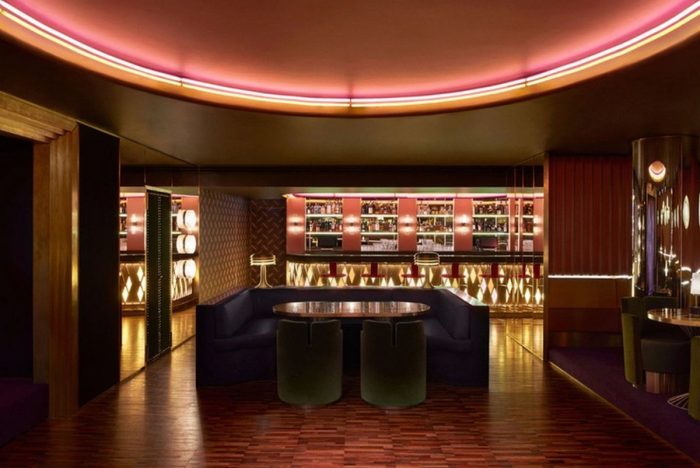
Find the location of a particular element. back wall lights is located at coordinates (297, 221), (350, 222), (406, 220), (458, 226).